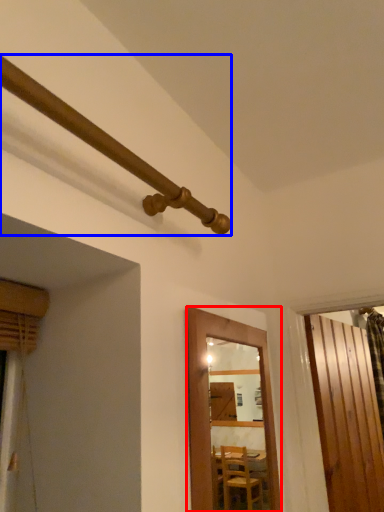
Question: Which point is closer to the camera, door (highlighted by a red box) or pipe (highlighted by a blue box)?

Choices:
 (A) door
 (B) pipe

Answer: (B)